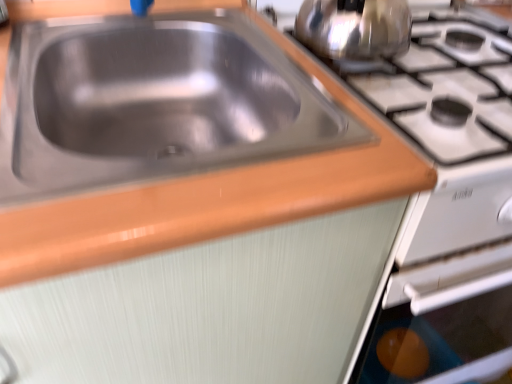
Question: Considering the positions of stainless steel sink at upper left and shiny metallic kettle at upper right in the image, is stainless steel sink at upper left bigger or smaller than shiny metallic kettle at upper right?

Choices:
 (A) small
 (B) big

Answer: (B)

Question: In terms of height, does stainless steel sink at upper left look taller or shorter compared to shiny metallic kettle at upper right?

Choices:
 (A) tall
 (B) short

Answer: (B)

Question: Is stainless steel sink at upper left to the left or to the right of shiny metallic kettle at upper right in the image?

Choices:
 (A) right
 (B) left

Answer: (B)

Question: Is shiny metallic kettle at upper right to the left or to the right of stainless steel sink at upper left in the image?

Choices:
 (A) right
 (B) left

Answer: (A)

Question: In the image, is shiny metallic kettle at upper right positioned in front of or behind stainless steel sink at upper left?

Choices:
 (A) front
 (B) behind

Answer: (B)

Question: From the image's perspective, is shiny metallic kettle at upper right located above or below stainless steel sink at upper left?

Choices:
 (A) above
 (B) below

Answer: (A)

Question: Considering the positions of shiny metallic kettle at upper right and stainless steel sink at upper left in the image, is shiny metallic kettle at upper right wider or thinner than stainless steel sink at upper left?

Choices:
 (A) thin
 (B) wide

Answer: (A)